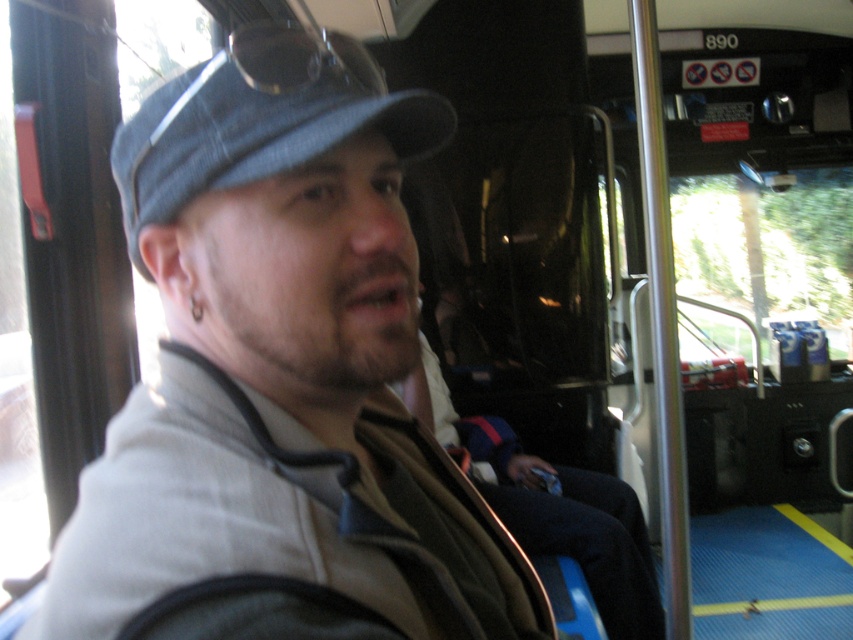
You are a bus passenger who needs to place a 2.0 meter long item between the denim baseball cap at center and the dark blue fabric jacket at center. Can you fit it in the space between them?

The denim baseball cap at center is 1.93 meters from the dark blue fabric jacket at center. Since the item is 2.0 meters long, it cannot fit in the space between them as the distance is slightly shorter than the item.